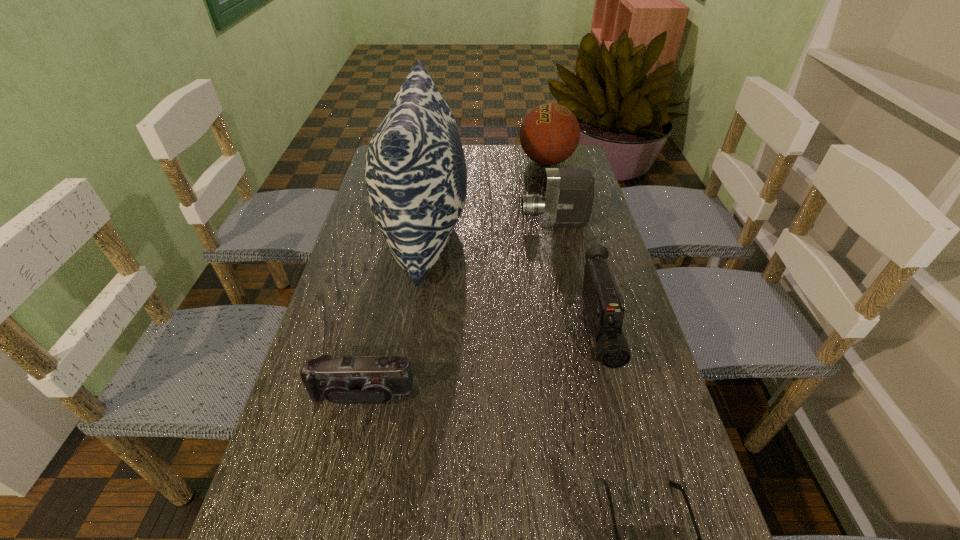
What are the coordinates of `the tallest object` in the screenshot? It's located at (415, 171).

Identify the location of the farthest object. This screenshot has height=540, width=960. (550, 133).

Where is `the farthest camcorder`? the farthest camcorder is located at coordinates (566, 200).

Where is `the leftmost camcorder`? the leftmost camcorder is located at coordinates (367, 379).

At what (x,y) coordinates should I click in order to perform the action: click on the shortest camcorder. Please return your answer as a coordinate pair (x, y). Looking at the image, I should click on tap(367, 379).

Find the location of a particular element. This screenshot has width=960, height=540. vacant region located 0.150m on the front surface of the tallest object is located at coordinates (519, 235).

Locate an element on the screen. This screenshot has height=540, width=960. vacant space located 0.240m on the left of the basketball is located at coordinates (452, 162).

Image resolution: width=960 pixels, height=540 pixels. I want to click on free spot located at the front of the farthest camcorder, highlighting the lens, so click(392, 224).

In order to click on vacant point located at the front of the farthest camcorder, highlighting the lens in this screenshot , I will do `click(396, 224)`.

You are a GUI agent. You are given a task and a screenshot of the screen. Output one action in this format:
    pyautogui.click(x=<x>, y=<y>)
    Task: Click on the vacant region located at the front of the farthest camcorder, highlighting the lens
    The width and height of the screenshot is (960, 540).
    Given the screenshot: What is the action you would take?
    pyautogui.click(x=442, y=224)